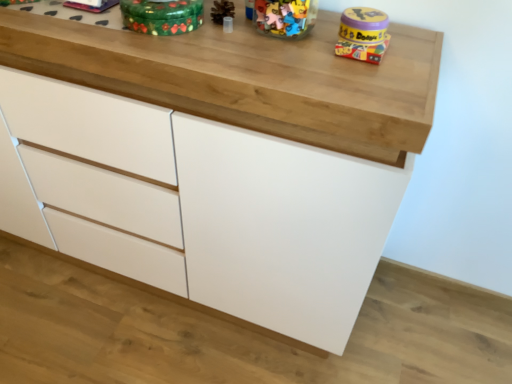
Where is `vacant position to the left of matte yellow plastic toy at upper right, the first toy when ordered from right to left`? The width and height of the screenshot is (512, 384). vacant position to the left of matte yellow plastic toy at upper right, the first toy when ordered from right to left is located at coordinates (285, 42).